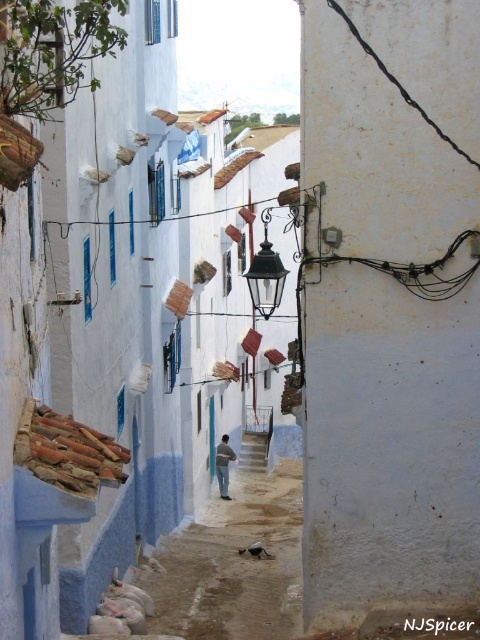
Question: Can you confirm if black glass lantern at center is positioned to the left of blue fabric man at center?

Choices:
 (A) yes
 (B) no

Answer: (B)

Question: Which object is farther from the camera taking this photo?

Choices:
 (A) smooth concrete stairs at center
 (B) blue fabric man at center

Answer: (A)

Question: Does smooth concrete stairs at center appear on the right side of blue fabric man at center?

Choices:
 (A) yes
 (B) no

Answer: (A)

Question: Which object appears farthest from the camera in this image?

Choices:
 (A) blue fabric man at center
 (B) smooth concrete stairs at center

Answer: (B)

Question: Which point is farther to the camera?

Choices:
 (A) (274, 259)
 (B) (255, 468)

Answer: (B)

Question: Does smooth concrete stairs at center have a greater width compared to blue fabric man at center?

Choices:
 (A) yes
 (B) no

Answer: (A)